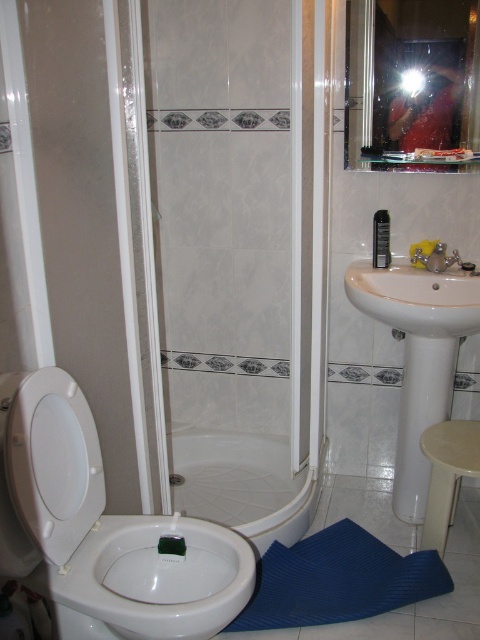
Question: Which of the following is the farthest from the observer?

Choices:
 (A) beige plastic stool at lower right
 (B) transparent plastic screen door at left
 (C) yellow matte faucet at upper right
 (D) white glossy bathtub at center

Answer: (C)

Question: In this image, where is transparent plastic screen door at left located relative to white glossy bidet at lower left?

Choices:
 (A) left
 (B) right

Answer: (A)

Question: Considering the relative positions of white glossy bidet at lower left and beige plastic stool at lower right in the image provided, where is white glossy bidet at lower left located with respect to beige plastic stool at lower right?

Choices:
 (A) left
 (B) right

Answer: (A)

Question: Which object is positioned farthest from the yellow matte faucet at upper right?

Choices:
 (A) white glossy shower door at center
 (B) white glossy bidet at lower left

Answer: (B)

Question: Is transparent plastic screen door at left bigger than yellow matte faucet at upper right?

Choices:
 (A) yes
 (B) no

Answer: (A)

Question: Which point is closer to the camera?

Choices:
 (A) white glossy shower door at center
 (B) transparent plastic screen door at left

Answer: (B)